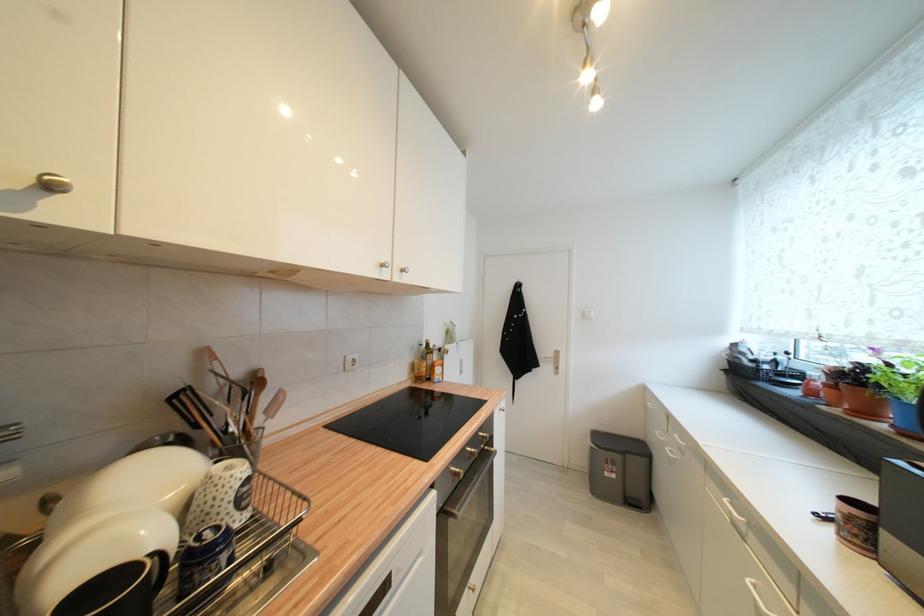
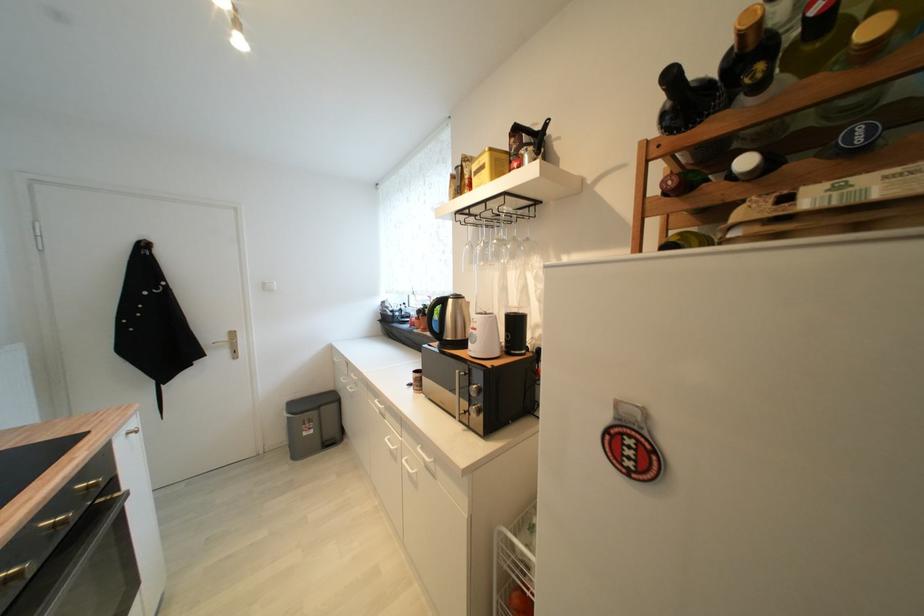
The point at (492, 450) is marked in the first image. Where is the corresponding point in the second image?

(107, 503)